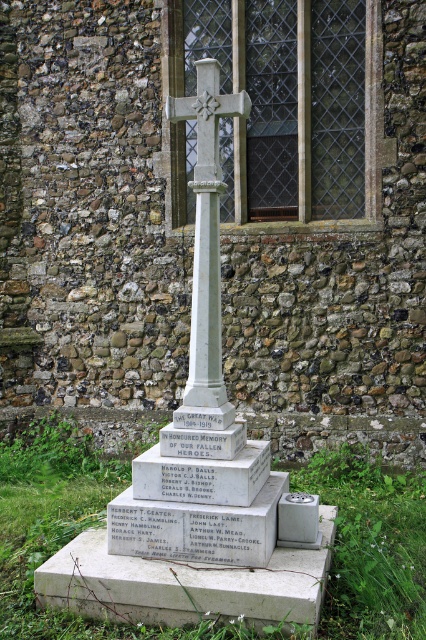
You are a visitor at the memorial and want to take a photo of both the gray stone cross at center and the white stone cross at center. Which cross should you focus on first to ensure both are in the frame?

You should focus on the gray stone cross at center first because it is much taller than the white stone cross at center, so positioning the camera to include its full height will naturally include the smaller white stone cross at center in the frame.

You are standing in front of the memorial described in the scene. If you were to walk directly towards the gray stone cross at center, which direction should you face?

Since the gray stone cross at center is located at coordinates point (199, 474), you should face towards the center of the memorial to walk directly towards it.

What is the object located at the coordinates point (199, 474) in the image?

The gray stone cross at center is located at point (199, 474).